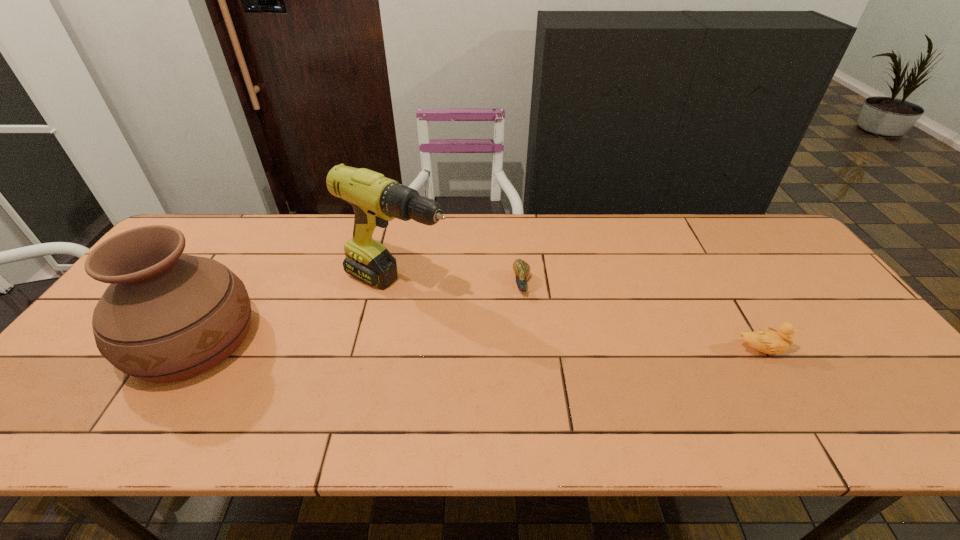
Locate an element on the screen. The image size is (960, 540). vacant space at the near edge is located at coordinates (807, 401).

Locate an element on the screen. The width and height of the screenshot is (960, 540). vacant space at the right edge of the desktop is located at coordinates (848, 345).

You are a GUI agent. You are given a task and a screenshot of the screen. Output one action in this format:
    pyautogui.click(x=<x>, y=<y>)
    Task: Click on the vacant space at the far left corner of the desktop
    This screenshot has width=960, height=540.
    Given the screenshot: What is the action you would take?
    pyautogui.click(x=195, y=241)

The image size is (960, 540). In order to click on free space at the far right corner in this screenshot , I will do `click(740, 215)`.

Locate an element on the screen. The width and height of the screenshot is (960, 540). empty space that is in between the second object from left to right and the third object from left to right is located at coordinates (460, 286).

Find the location of a particular element. Image resolution: width=960 pixels, height=540 pixels. free point between the leftmost object and the second shortest object is located at coordinates coord(476,345).

Find the location of a particular element. This screenshot has height=540, width=960. free space between the escargot and the drill is located at coordinates (460, 286).

You are a GUI agent. You are given a task and a screenshot of the screen. Output one action in this format:
    pyautogui.click(x=<x>, y=<y>)
    Task: Click on the free space that is in between the escargot and the drill
    
    Given the screenshot: What is the action you would take?
    pyautogui.click(x=460, y=286)

Where is `blank region between the urn and the tallest object`? Image resolution: width=960 pixels, height=540 pixels. blank region between the urn and the tallest object is located at coordinates (296, 313).

Where is `unoccupied position between the duckling and the escargot`? The width and height of the screenshot is (960, 540). unoccupied position between the duckling and the escargot is located at coordinates (640, 318).